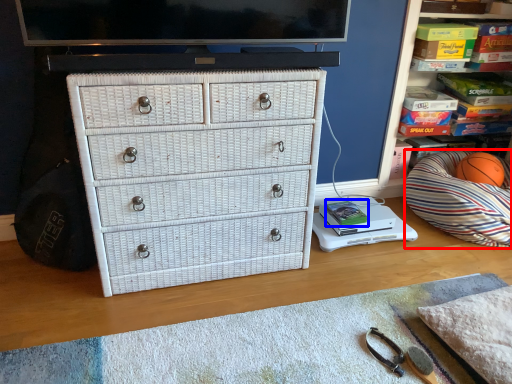
Question: Which of the following is the closest to the observer, throw pillow (highlighted by a red box) or book (highlighted by a blue box)?

Choices:
 (A) throw pillow
 (B) book

Answer: (A)